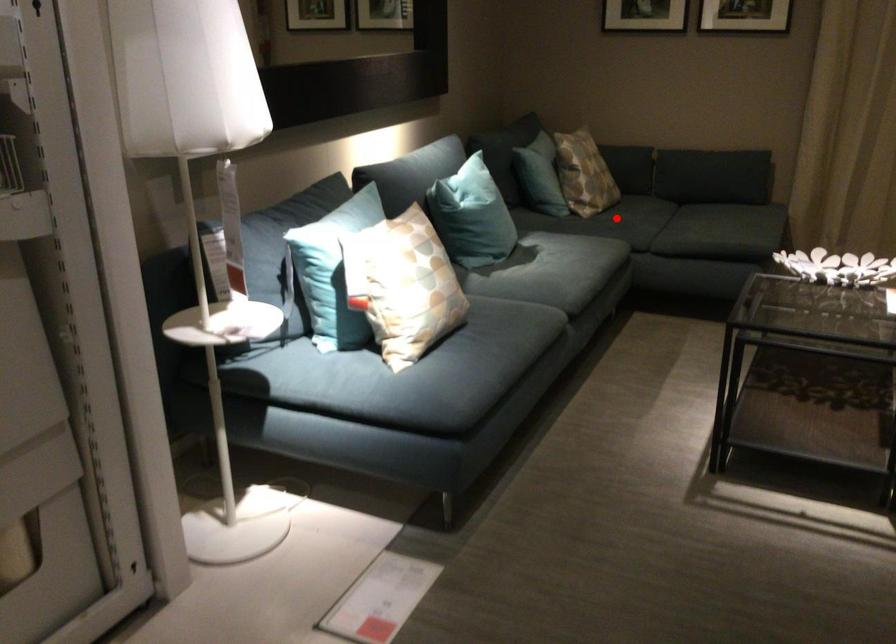
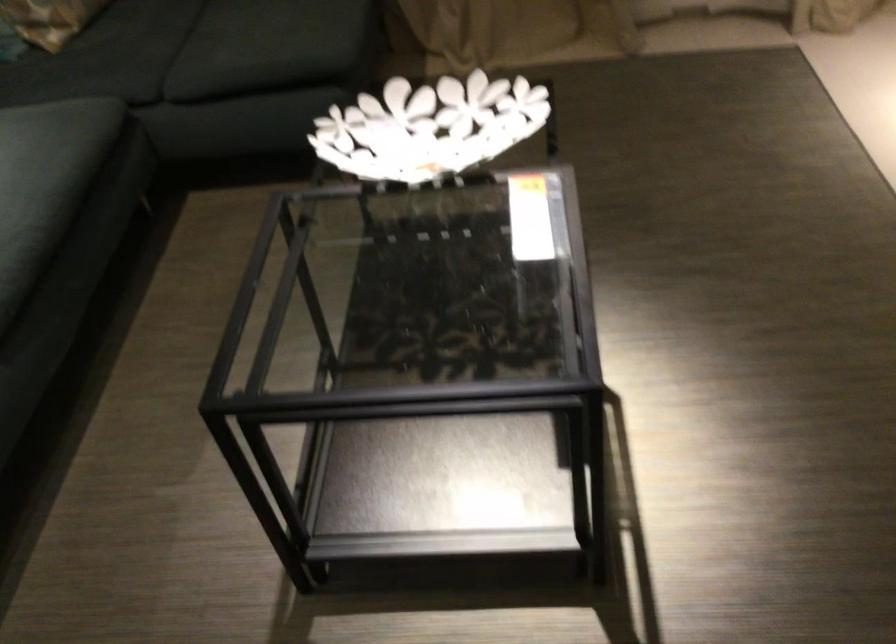
Question: I am providing you with two images of the same scene from different viewpoints. A red point is shown in image1. For the corresponding object point in image2, is it positioned nearer or farther from the camera?

Choices:
 (A) Nearer
 (B) Farther

Answer: (A)